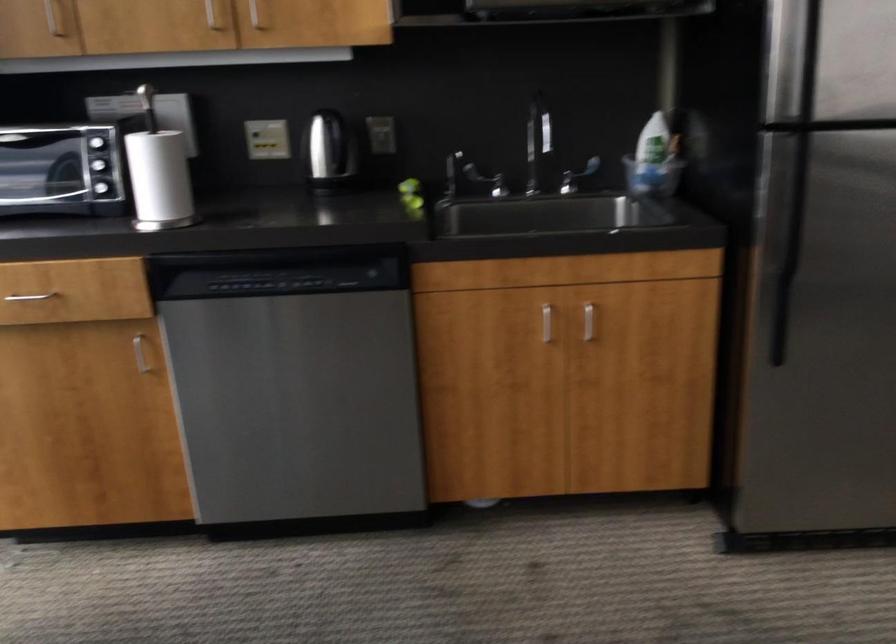
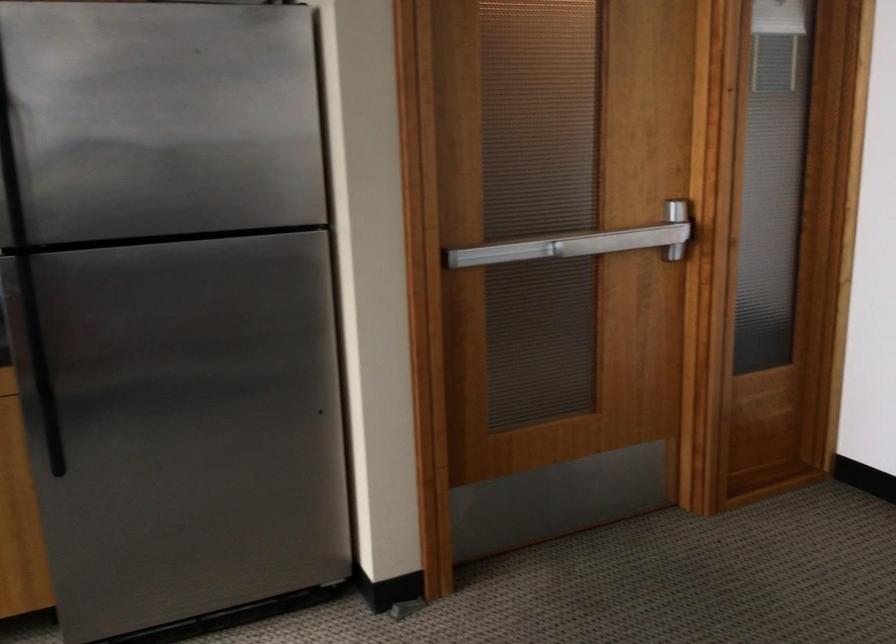
Question: Based on the continuous images, in which direction is the camera rotating? Reply with the corresponding letter.

Choices:
 (A) Left
 (B) Right
 (C) Up
 (D) Down

Answer: (B)